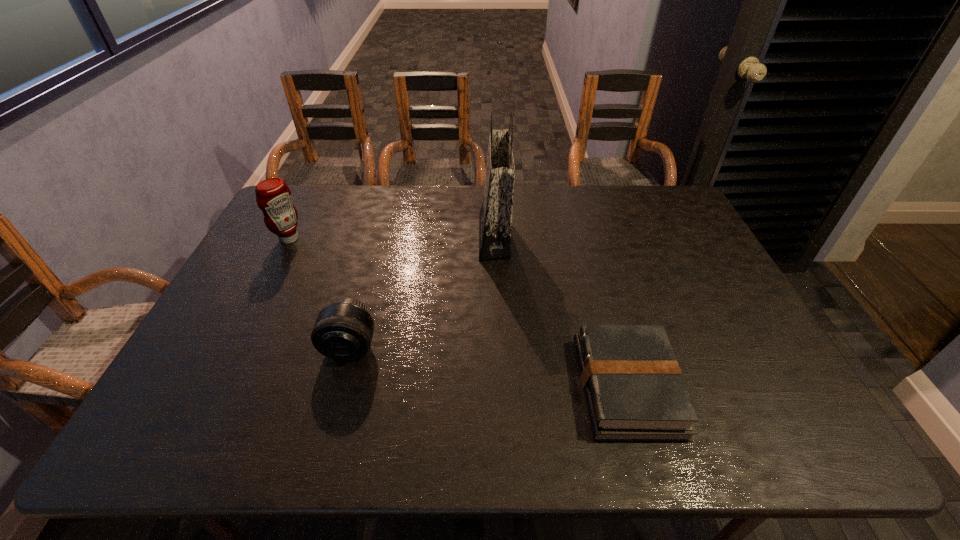
This screenshot has width=960, height=540. Identify the location of free space that is in between the condiment and the shopping bag. (392, 238).

The image size is (960, 540). What are the coordinates of `vacant space that's between the rightmost object and the condiment` in the screenshot? It's located at (458, 313).

Locate an element on the screen. vacant point located between the third tallest object and the shortest object is located at coordinates (489, 367).

Identify the location of object that is the closest to the second tallest object. This screenshot has height=540, width=960. (343, 331).

Find the location of a particular element. The image size is (960, 540). object that is the closest one to the hardback book is located at coordinates (495, 218).

You are a GUI agent. You are given a task and a screenshot of the screen. Output one action in this format:
    pyautogui.click(x=<x>, y=<y>)
    Task: Click on the free space that satisfies the following two spatial constraints: 1. on the front of the tallest object with the design; 2. on the front-facing side of the third object from right to left
    
    Given the screenshot: What is the action you would take?
    pyautogui.click(x=498, y=347)

Identify the location of free space that satisfies the following two spatial constraints: 1. on the front of the third object from left to right with the design; 2. on the front-facing side of the third tallest object. Image resolution: width=960 pixels, height=540 pixels. (498, 347).